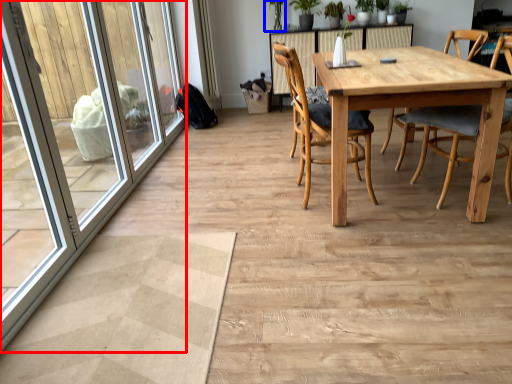
Question: Which object appears closest to the camera in this image, screen door (highlighted by a red box) or plant (highlighted by a blue box)?

Choices:
 (A) screen door
 (B) plant

Answer: (A)